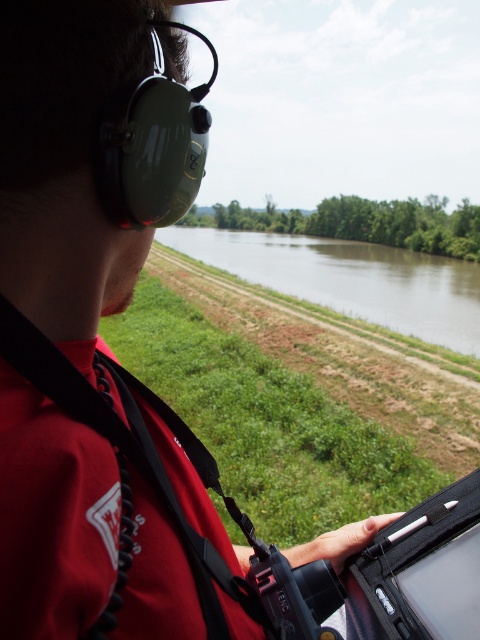
Looking at this image, you are a passenger in a helicopter and need to determine if the red fabric life jacket at lower left is above or below the brown muddy water at center. Based on the scene, what is the position of the life jacket relative to the water?

The red fabric life jacket at lower left has a lesser height compared to brown muddy water at center, meaning it is below the water.

Based on the photo, you are a passenger in the helicopter and need to retrieve the red fabric life jacket at lower left and the brown muddy water at center. Which object is closer to you?

The red fabric life jacket at lower left is closer because it is in front of the brown muddy water at center.